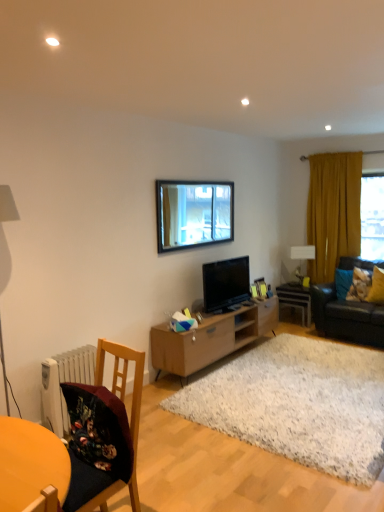
What do you see at coordinates (298, 404) in the screenshot? I see `white shaggy rug at center` at bounding box center [298, 404].

The image size is (384, 512). Describe the element at coordinates (254, 290) in the screenshot. I see `wooden picture frame at center, which is the 1th picture frame in left-to-right order` at that location.

Describe the element at coordinates (376, 286) in the screenshot. I see `yellow fabric pillow at right, acting as the second pillow starting from the left` at that location.

What is the approximate height of white glossy lampshade at upper right?

white glossy lampshade at upper right is 23.75 inches in height.

What do you see at coordinates (303, 252) in the screenshot? The image size is (384, 512). I see `white glossy lampshade at upper right` at bounding box center [303, 252].

Measure the distance between white glossy side table at center and camera.

They are 5.67 meters apart.

Measure the distance between point (289,289) and camera.

Point (289,289) and camera are 6.08 meters apart.

What do you see at coordinates (193, 214) in the screenshot? I see `clear glass window at center` at bounding box center [193, 214].

In order to face clear glass window at center, should I rotate leftwards or rightwards?

To align with it, rotate right about 1.125°.

This screenshot has width=384, height=512. Identify the location of light brown wood tv stand at center. (211, 338).

Is satin black tv at center smaller than white glossy side table at center?

Indeed, satin black tv at center has a smaller size compared to white glossy side table at center.

From a real-world perspective, is satin black tv at center below white glossy side table at center?

No.

Does satin black tv at center turn towards white glossy side table at center?

No, satin black tv at center is not aimed at white glossy side table at center.

Considering the positions of objects satin black tv at center and white glossy side table at center in the image provided, who is more to the left, satin black tv at center or white glossy side table at center?

From the viewer's perspective, satin black tv at center appears more on the left side.

Looking at this image, do you think yellow fabric pillow at right, marked as the first pillow in a left-to-right arrangement, is within satin black tv at center, or outside of it?

yellow fabric pillow at right, marked as the first pillow in a left-to-right arrangement, is spatially situated outside satin black tv at center.

Considering the points (353, 272) and (227, 288), which point is behind, point (353, 272) or point (227, 288)?

The point (353, 272) is farther from the camera.

From a real-world perspective, is yellow fabric pillow at right, which is the 2th pillow from right to left, above or below satin black tv at center?

yellow fabric pillow at right, which is the 2th pillow from right to left, is below satin black tv at center.

In the scene shown: Is satin black tv at center at the back of yellow fabric pillow at right, which is the 2th pillow from right to left?

No, yellow fabric pillow at right, which is the 2th pillow from right to left, is not facing the opposite direction of satin black tv at center.

In order to click on the 1st picture frame positioned below the clear glass window at center (from a real-world perspective) in this screenshot , I will do `click(261, 287)`.

Measure the distance from wooden picture frame at center, which appears as the 1th picture frame when viewed from the right, to clear glass window at center.

wooden picture frame at center, which appears as the 1th picture frame when viewed from the right, and clear glass window at center are 4.02 feet apart.

Could you tell me if wooden picture frame at center, positioned as the 2th picture frame in left-to-right order, is facing clear glass window at center?

No, wooden picture frame at center, positioned as the 2th picture frame in left-to-right order, is not aimed at clear glass window at center.

Between wooden picture frame at center, which appears as the 1th picture frame when viewed from the right, and clear glass window at center, which one appears on the left side from the viewer's perspective?

clear glass window at center is more to the left.

Locate an element on the screen. The image size is (384, 512). cabinetry located on the left of wooden picture frame at center, which is the 1th picture frame in left-to-right order is located at coordinates (211, 338).

Relative to light brown wood tv stand at center, is wooden picture frame at center, placed as the 2th picture frame when sorted from right to left, in front or behind?

Visually, wooden picture frame at center, placed as the 2th picture frame when sorted from right to left, is located behind light brown wood tv stand at center.

Which is correct: wooden picture frame at center, placed as the 2th picture frame when sorted from right to left, is inside light brown wood tv stand at center, or outside of it?

wooden picture frame at center, placed as the 2th picture frame when sorted from right to left, is spatially situated outside light brown wood tv stand at center.

Considering the relative sizes of wooden picture frame at center, placed as the 2th picture frame when sorted from right to left, and light brown wood tv stand at center in the image provided, is wooden picture frame at center, placed as the 2th picture frame when sorted from right to left, taller than light brown wood tv stand at center?

Incorrect, the height of wooden picture frame at center, placed as the 2th picture frame when sorted from right to left, is not larger of that of light brown wood tv stand at center.

Consider the image. Does mustard yellow fabric curtain at right contain satin black tv at center?

Actually, satin black tv at center is outside mustard yellow fabric curtain at right.

Is mustard yellow fabric curtain at right far away from satin black tv at center?

Indeed, mustard yellow fabric curtain at right is not near satin black tv at center.

In terms of height, does mustard yellow fabric curtain at right look taller or shorter compared to satin black tv at center?

mustard yellow fabric curtain at right is taller than satin black tv at center.

Based on their sizes in the image, would you say mustard yellow fabric curtain at right is bigger or smaller than satin black tv at center?

Considering their sizes, mustard yellow fabric curtain at right takes up more space than satin black tv at center.

Is wooden picture frame at center, positioned as the 2th picture frame in left-to-right order, oriented towards white glossy side table at center?

No, wooden picture frame at center, positioned as the 2th picture frame in left-to-right order, is not facing towards white glossy side table at center.

Can you confirm if wooden picture frame at center, positioned as the 2th picture frame in left-to-right order, is taller than white glossy side table at center?

In fact, wooden picture frame at center, positioned as the 2th picture frame in left-to-right order, may be shorter than white glossy side table at center.

In terms of size, does wooden picture frame at center, which appears as the 1th picture frame when viewed from the right, appear bigger or smaller than white glossy side table at center?

Considering their sizes, wooden picture frame at center, which appears as the 1th picture frame when viewed from the right, takes up less space than white glossy side table at center.

Would you say wooden picture frame at center, which appears as the 1th picture frame when viewed from the right, is outside white glossy side table at center?

Yes.

From a real-world perspective, relative to white glossy lampshade at upper right, is clear glass window at center vertically above or below?

In terms of real-world spatial position, clear glass window at center is above white glossy lampshade at upper right.

Is clear glass window at center touching white glossy lampshade at upper right?

No, clear glass window at center is not with white glossy lampshade at upper right.

From the image's perspective, which is below, clear glass window at center or white glossy lampshade at upper right?

white glossy lampshade at upper right is shown below in the image.

In order to click on television located on the left of white glossy side table at center in this screenshot , I will do `click(225, 283)`.

I want to click on pillow that is the 1st object located below the satin black tv at center (from the image's perspective), so click(360, 285).

Which object lies further to the anchor point yellow fabric pillow at right, acting as the second pillow starting from the left, black leather couch at right or white shaggy rug at center?

The object further to yellow fabric pillow at right, acting as the second pillow starting from the left, is white shaggy rug at center.

Which object lies nearer to the anchor point white glossy lampshade at upper right, yellow fabric pillow at right, marked as the first pillow in a left-to-right arrangement, or black leather couch at right?

yellow fabric pillow at right, marked as the first pillow in a left-to-right arrangement, is positioned closer to the anchor white glossy lampshade at upper right.

Considering their positions, is wooden picture frame at center, which appears as the 1th picture frame when viewed from the right, positioned closer to yellow fabric pillow at right, marked as the first pillow in a left-to-right arrangement, than wooden chair at lower left?

Based on the image, wooden picture frame at center, which appears as the 1th picture frame when viewed from the right, appears to be nearer to yellow fabric pillow at right, marked as the first pillow in a left-to-right arrangement.

Estimate the real-world distances between objects in this image. Which object is closer to mustard yellow fabric curtain at right, black leather couch at right or yellow fabric pillow at right, acting as the second pillow starting from the left?

black leather couch at right.

Based on their spatial positions, is white glossy side table at center or yellow fabric pillow at right, marked as the first pillow in a left-to-right arrangement, closer to white shaggy rug at center?

yellow fabric pillow at right, marked as the first pillow in a left-to-right arrangement.

Which object lies nearer to the anchor point mustard yellow fabric curtain at right, white shaggy rug at center or black leather couch at right?

The object closer to mustard yellow fabric curtain at right is black leather couch at right.

From the picture: From the image, which object appears to be farther from wooden chair at lower left, satin black tv at center or white shaggy rug at center?

Among the two, satin black tv at center is located further to wooden chair at lower left.

Which object lies nearer to the anchor point wooden picture frame at center, placed as the 2th picture frame when sorted from right to left, clear glass window at center or yellow fabric pillow at right, positioned as the 1th pillow in right-to-left order?

clear glass window at center is positioned closer to the anchor wooden picture frame at center, placed as the 2th picture frame when sorted from right to left.

Image resolution: width=384 pixels, height=512 pixels. In order to click on table located between light brown wood tv stand at center and yellow fabric pillow at right, marked as the first pillow in a left-to-right arrangement, in the left-right direction in this screenshot , I will do (x=296, y=298).

Identify the location of television between wooden chair at lower left and mustard yellow fabric curtain at right in the front-back direction. (225, 283).

Identify the location of television between white shaggy rug at center and black leather couch at right from front to back. Image resolution: width=384 pixels, height=512 pixels. (225, 283).

Find the location of `window between wooden chair at lower left and wooden picture frame at center, which is the 1th picture frame in left-to-right order, in the front-back direction`. window between wooden chair at lower left and wooden picture frame at center, which is the 1th picture frame in left-to-right order, in the front-back direction is located at coordinates (193, 214).